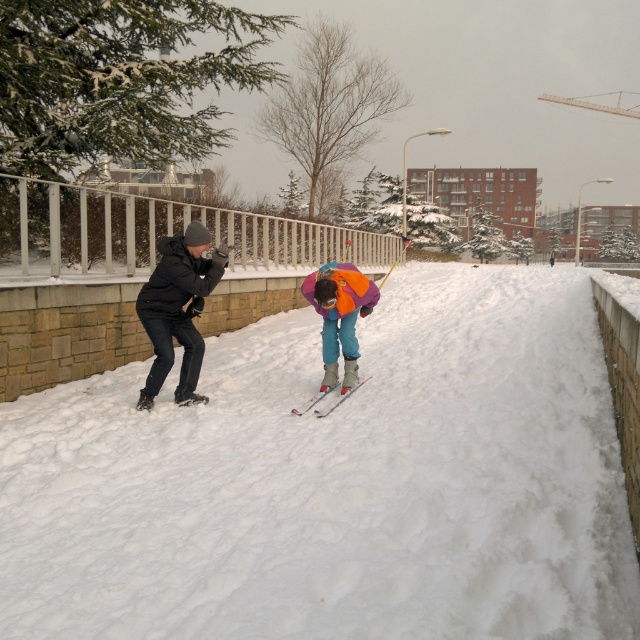
You are trying to determine which jacket is on top between the matte black jacket at left and the dark gray matte jacket at left. Based on the scene description, which one is visible above the other?

The matte black jacket at left is positioned over the dark gray matte jacket at left, so the matte black jacket at left is visible above the dark gray matte jacket at left.

You are planning to buy a winter jacket for a cold day. You see two jackets in the image, the matte black jacket at left and the dark gray matte jacket at left. Which jacket is narrower in width?

The matte black jacket at left is narrower in width than the dark gray matte jacket at left.

You are planning to take a photo of the matte black jacket at left and the metallic silver skis at center in the snowy scene. To ensure both are in focus, which object should you focus on first considering their distances from you?

You should focus on the matte black jacket at left first because it is closer to you than the metallic silver skis at center, so adjusting focus from near to far will help both be in focus.